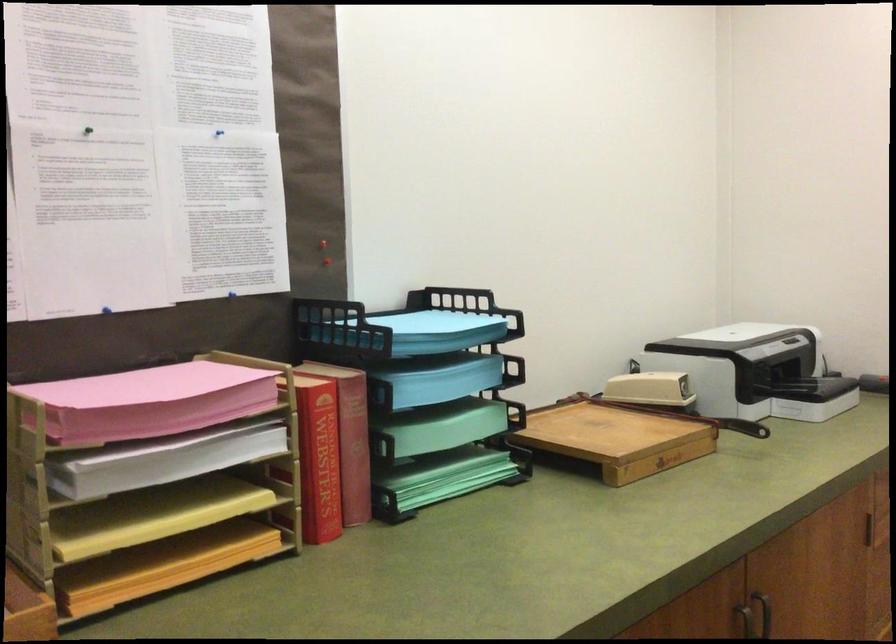
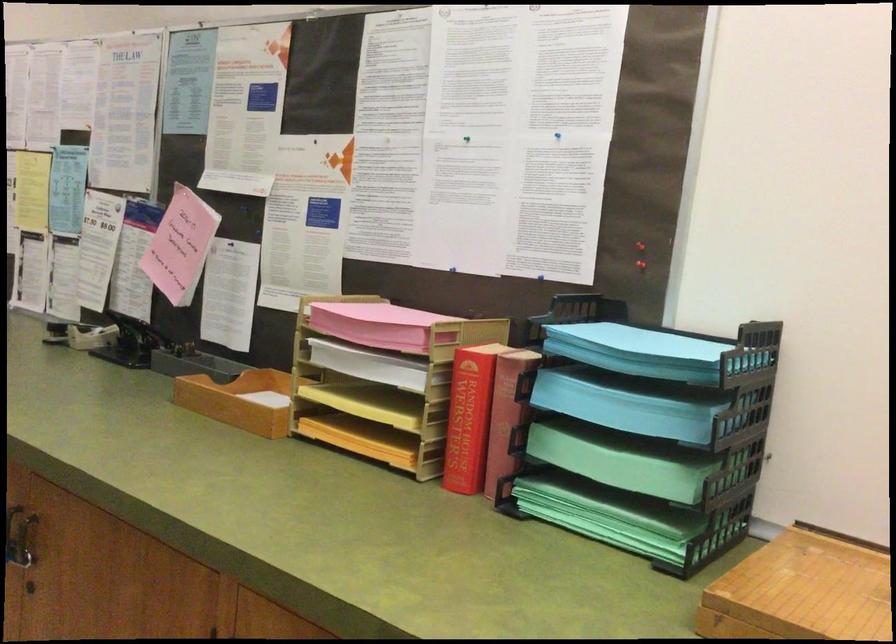
The point at (x=210, y=134) is marked in the first image. Where is the corresponding point in the second image?

(556, 135)